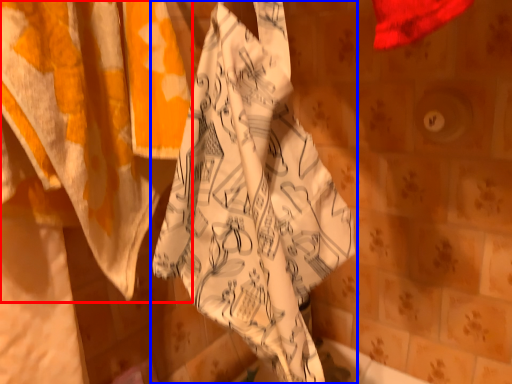
Question: Which point is closer to the camera, curtain (highlighted by a red box) or towel (highlighted by a blue box)?

Choices:
 (A) curtain
 (B) towel

Answer: (A)